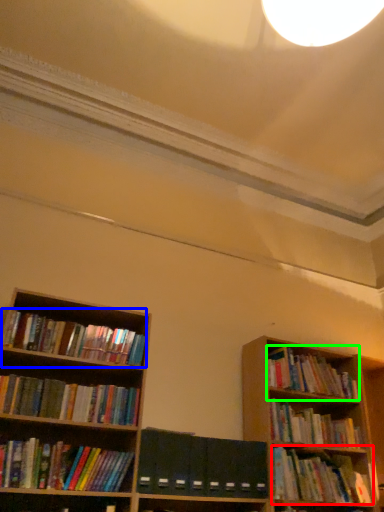
Question: Considering the real-world distances, which object is closest to book (highlighted by a red box)? book (highlighted by a blue box) or book (highlighted by a green box).

Choices:
 (A) book
 (B) book

Answer: (B)